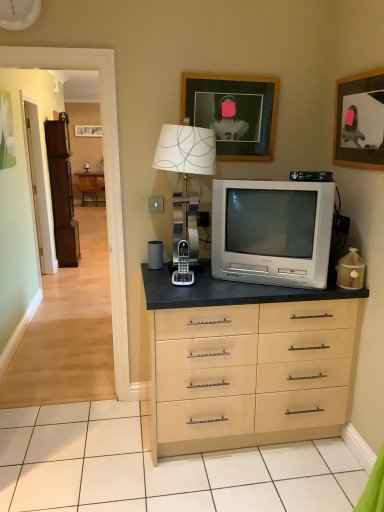
Describe the element at coordinates (62, 191) in the screenshot. The height and width of the screenshot is (512, 384). I see `brown wooden armoire at left` at that location.

Where is `wooden floor at left`? This screenshot has width=384, height=512. wooden floor at left is located at coordinates (107, 157).

Find the location of a particular element. black plastic phone at center is located at coordinates (183, 266).

The image size is (384, 512). What do you see at coordinates (233, 112) in the screenshot?
I see `wooden picture frame at upper center, the second picture frame from the right` at bounding box center [233, 112].

Describe the element at coordinates (18, 13) in the screenshot. I see `white matte clock at upper left` at that location.

Where is `metallic silver table lamp at center`? metallic silver table lamp at center is located at coordinates (186, 151).

Is point (77, 243) closer or farther from the camera than point (34, 5)?

Point (77, 243) is farther from the camera than point (34, 5).

From the picture: Is brown wooden armoire at left completely or partially outside of white matte clock at upper left?

That's correct, brown wooden armoire at left is outside of white matte clock at upper left.

Does brown wooden armoire at left have a greater height compared to white matte clock at upper left?

Yes, brown wooden armoire at left is taller than white matte clock at upper left.

Considering the sizes of objects brown wooden armoire at left and white matte clock at upper left in the image provided, who is thinner, brown wooden armoire at left or white matte clock at upper left?

With smaller width is white matte clock at upper left.

Between slate gray matte speaker at center and metallic silver table lamp at center, which one appears on the left side from the viewer's perspective?

From the viewer's perspective, slate gray matte speaker at center appears more on the left side.

Is slate gray matte speaker at center bigger than metallic silver table lamp at center?

No, slate gray matte speaker at center is not bigger than metallic silver table lamp at center.

Consider the image. Does slate gray matte speaker at center have a greater height compared to metallic silver table lamp at center?

No.

From a real-world perspective, is black plastic phone at center physically located above or below metallic silver table lamp at center?

From a real-world perspective, black plastic phone at center is physically below metallic silver table lamp at center.

Can you confirm if black plastic phone at center is bigger than metallic silver table lamp at center?

No.

Is black plastic phone at center shorter than metallic silver table lamp at center?

Yes.

From the image's perspective, is black plastic phone at center positioned above or below metallic silver table lamp at center?

black plastic phone at center is situated lower than metallic silver table lamp at center in the image.

Considering the relative sizes of brown wooden armoire at left and wooden picture frame at upper center, placed as the 1th picture frame when sorted from left to right, in the image provided, is brown wooden armoire at left thinner than wooden picture frame at upper center, placed as the 1th picture frame when sorted from left to right,?

In fact, brown wooden armoire at left might be wider than wooden picture frame at upper center, placed as the 1th picture frame when sorted from left to right.

Relative to wooden picture frame at upper center, placed as the 1th picture frame when sorted from left to right, is brown wooden armoire at left in front or behind?

Clearly, brown wooden armoire at left is behind wooden picture frame at upper center, placed as the 1th picture frame when sorted from left to right.

Is brown wooden armoire at left far away from wooden picture frame at upper center, the second picture frame from the right?

Yes, brown wooden armoire at left and wooden picture frame at upper center, the second picture frame from the right, are quite far apart.

Between brown wooden armoire at left and wooden picture frame at upper center, the second picture frame from the right, which one has more height?

With more height is brown wooden armoire at left.

From the image's perspective, which object appears higher, black plastic phone at center or brown wooden armoire at left?

brown wooden armoire at left is shown above in the image.

Considering the relative positions of black plastic phone at center and brown wooden armoire at left in the image provided, is black plastic phone at center to the left of brown wooden armoire at left from the viewer's perspective?

No.

Is black plastic phone at center not within brown wooden armoire at left?

Yes.

From a real-world perspective, is black plastic phone at center beneath brown wooden armoire at left?

No, from a real-world perspective, black plastic phone at center is not below brown wooden armoire at left.

From a real-world perspective, is brown wooden armoire at left on wooden picture frame at upper right, marked as the 2th picture frame in a left-to-right arrangement?

Actually, brown wooden armoire at left is physically below wooden picture frame at upper right, marked as the 2th picture frame in a left-to-right arrangement, in the real world.

Which is more to the right, brown wooden armoire at left or wooden picture frame at upper right, marked as the 2th picture frame in a left-to-right arrangement?

wooden picture frame at upper right, marked as the 2th picture frame in a left-to-right arrangement, is more to the right.

Could you tell me if brown wooden armoire at left is facing wooden picture frame at upper right, marked as the 2th picture frame in a left-to-right arrangement?

No, brown wooden armoire at left is not turned towards wooden picture frame at upper right, marked as the 2th picture frame in a left-to-right arrangement.

Is white matte clock at upper left next to wooden floor at left?

No, white matte clock at upper left is not in contact with wooden floor at left.

Is white matte clock at upper left positioned beyond the bounds of wooden floor at left?

That's correct, white matte clock at upper left is outside of wooden floor at left.

Considering the relative sizes of white matte clock at upper left and wooden floor at left in the image provided, is white matte clock at upper left shorter than wooden floor at left?

Yes, white matte clock at upper left is shorter than wooden floor at left.

Find the location of a particular element. The image size is (384, 512). clock above the brown wooden armoire at left (from a real-world perspective) is located at coordinates (18, 13).

Image resolution: width=384 pixels, height=512 pixels. What are the coordinates of `speaker below the metallic silver table lamp at center (from the image's perspective)` in the screenshot? It's located at [x=155, y=255].

When comparing their distances from brown wooden armoire at left, does slate gray matte speaker at center or white matte clock at upper left seem closer?

The object closer to brown wooden armoire at left is slate gray matte speaker at center.

Looking at the image, which one is located further to black plastic phone at center, wooden floor at left or slate gray matte speaker at center?

wooden floor at left is further to black plastic phone at center.

Considering their positions, is silver metallic television at center positioned closer to wooden floor at left than metallic silver table lamp at center?

metallic silver table lamp at center is positioned closer to the anchor wooden floor at left.

Based on their spatial positions, is wooden picture frame at upper center, placed as the 1th picture frame when sorted from left to right, or slate gray matte speaker at center closer to silver metallic television at center?

wooden picture frame at upper center, placed as the 1th picture frame when sorted from left to right, is positioned closer to the anchor silver metallic television at center.

From the image, which object appears to be farther from brown wooden armoire at left, wooden picture frame at upper right, marked as the 2th picture frame in a left-to-right arrangement, or metallic silver table lamp at center?

wooden picture frame at upper right, marked as the 2th picture frame in a left-to-right arrangement.

Estimate the real-world distances between objects in this image. Which object is closer to wooden picture frame at upper right, the 1th picture frame viewed from the right, wooden picture frame at upper center, the second picture frame from the right, or slate gray matte speaker at center?

The object closer to wooden picture frame at upper right, the 1th picture frame viewed from the right, is wooden picture frame at upper center, the second picture frame from the right.

Considering their positions, is silver metallic television at center positioned further to wooden picture frame at upper right, marked as the 2th picture frame in a left-to-right arrangement, than wooden picture frame at upper center, placed as the 1th picture frame when sorted from left to right?

wooden picture frame at upper center, placed as the 1th picture frame when sorted from left to right, is further to wooden picture frame at upper right, marked as the 2th picture frame in a left-to-right arrangement.

Which object lies nearer to the anchor point wooden floor at left, slate gray matte speaker at center or black plastic phone at center?

Based on the image, slate gray matte speaker at center appears to be nearer to wooden floor at left.

At what (x,y) coordinates should I click in order to perform the action: click on appliance between metallic silver table lamp at center and brown wooden armoire at left along the z-axis. Please return your answer as a coordinate pair (x, y). Looking at the image, I should click on (183, 266).

Find the location of a particular element. This screenshot has width=384, height=512. appliance between wooden floor at left and silver metallic television at center in the horizontal direction is located at coordinates (183, 266).

What are the coordinates of `television between white matte clock at upper left and slate gray matte speaker at center from top to bottom` in the screenshot? It's located at (272, 232).

Image resolution: width=384 pixels, height=512 pixels. In order to click on speaker between wooden picture frame at upper right, the 1th picture frame viewed from the right, and brown wooden armoire at left from front to back in this screenshot , I will do `click(155, 255)`.